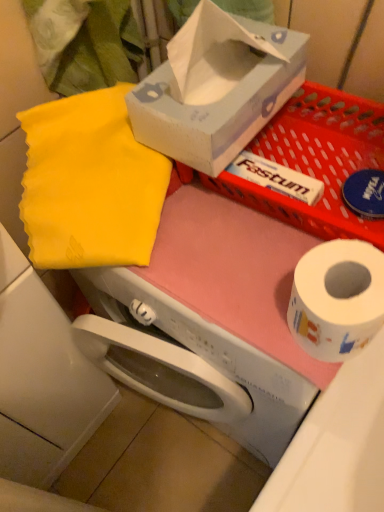
Where is `free spot behind white paper at right`? This screenshot has height=512, width=384. free spot behind white paper at right is located at coordinates (257, 226).